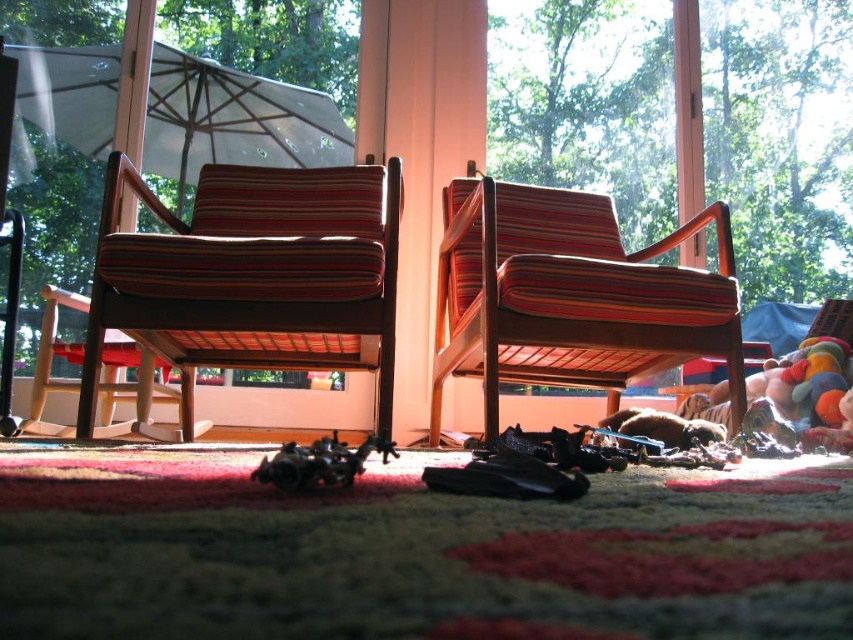
Question: Does striped fabric chair at center have a larger size compared to metallic black toy car at center?

Choices:
 (A) no
 (B) yes

Answer: (B)

Question: Does striped fabric chair at center have a lesser width compared to white fabric umbrella at upper left?

Choices:
 (A) yes
 (B) no

Answer: (A)

Question: Which point is closer to the camera?

Choices:
 (A) striped fabric chair at center
 (B) striped fabric chair at left
 (C) white fabric umbrella at upper left
 (D) metallic black toy car at center

Answer: (D)

Question: Can you confirm if striped fabric chair at center is smaller than white fabric umbrella at upper left?

Choices:
 (A) yes
 (B) no

Answer: (B)

Question: Which point is farther to the camera?

Choices:
 (A) (311, 484)
 (B) (689, 340)
 (C) (223, 68)

Answer: (C)

Question: Which point is closer to the camera?

Choices:
 (A) striped fabric chair at left
 (B) striped fabric chair at center
 (C) metallic black toy car at center
 (D) white fabric umbrella at upper left

Answer: (C)